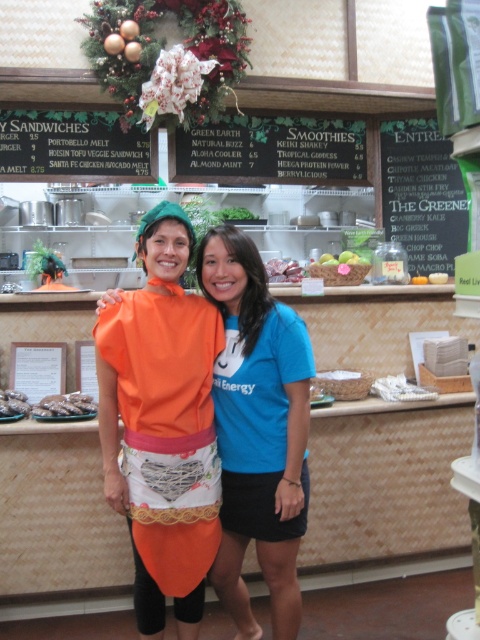
Question: From the image, what is the correct spatial relationship of blue fabric shirt at center in relation to green chalkboard at upper center?

Choices:
 (A) below
 (B) above

Answer: (A)

Question: Does green chalkboard at upper center have a larger size compared to brown crumbly cookies at center?

Choices:
 (A) no
 (B) yes

Answer: (B)

Question: Which of the following is the closest to the observer?

Choices:
 (A) (206, 525)
 (B) (68, 396)

Answer: (A)

Question: Which of the following is the closest to the observer?

Choices:
 (A) (72, 404)
 (B) (305, 513)
 (C) (105, 346)

Answer: (C)

Question: Which point appears farthest from the camera in this image?

Choices:
 (A) (188, 369)
 (B) (392, 216)
 (C) (6, 406)
 (D) (300, 364)

Answer: (B)

Question: In this image, where is orange fabric apron at center located relative to blue fabric shirt at center?

Choices:
 (A) above
 (B) below

Answer: (B)